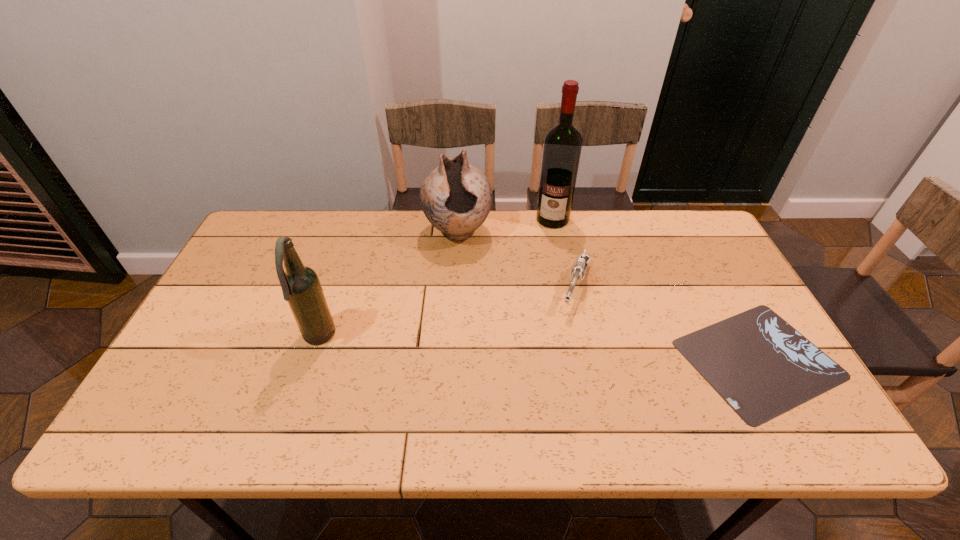
You are a GUI agent. You are given a task and a screenshot of the screen. Output one action in this format:
    pyautogui.click(x=<x>, y=<y>)
    Task: Click on the vacant space that satisfies the following two spatial constraints: 1. on the back side of the pottery; 2. on the left side of the alcohol
    
    Given the screenshot: What is the action you would take?
    pyautogui.click(x=459, y=219)

I want to click on vacant area in the image that satisfies the following two spatial constraints: 1. on the front side of the rightmost object; 2. on the right side of the alcohol, so click(x=580, y=359).

This screenshot has height=540, width=960. What are the coordinates of `free space that satisfies the following two spatial constraints: 1. on the front side of the shortest object; 2. on the left side of the fourth tallest object` in the screenshot? It's located at (591, 359).